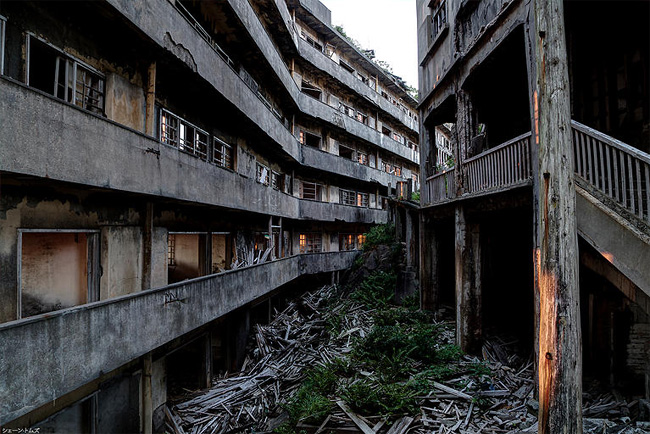
I want to click on stairs, so click(611, 185), click(632, 199), click(634, 208).